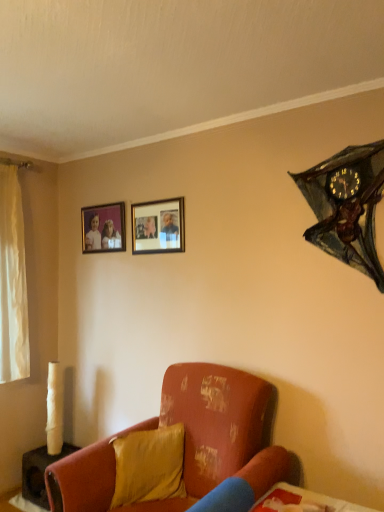
Describe the element at coordinates (103, 228) in the screenshot. This screenshot has width=384, height=512. I see `matte wooden picture frame at upper left, which is the second picture frame from right to left` at that location.

This screenshot has width=384, height=512. I want to click on matte black picture frame at upper center, which is the second picture frame in back-to-front order, so click(158, 226).

Identify the location of metallic bat-shaped clock at upper right. (347, 206).

Locate an element on the screen. This screenshot has width=384, height=512. distressed orange fabric couch at lower center is located at coordinates (180, 451).

Considering the relative sizes of distressed orange fabric couch at lower center and matte wooden picture frame at upper left, positioned as the 1th picture frame in left-to-right order, in the image provided, is distressed orange fabric couch at lower center thinner than matte wooden picture frame at upper left, positioned as the 1th picture frame in left-to-right order,?

No, distressed orange fabric couch at lower center is not thinner than matte wooden picture frame at upper left, positioned as the 1th picture frame in left-to-right order.

From the image's perspective, who appears lower, distressed orange fabric couch at lower center or matte wooden picture frame at upper left, which appears as the first picture frame when viewed from the back?

distressed orange fabric couch at lower center, from the image's perspective.

How different are the orientations of metallic bat-shaped clock at upper right and matte wooden picture frame at upper left, which appears as the first picture frame when viewed from the back, in degrees?

0.000541 degrees separate the facing orientations of metallic bat-shaped clock at upper right and matte wooden picture frame at upper left, which appears as the first picture frame when viewed from the back.

Looking at this image, is metallic bat-shaped clock at upper right wider or thinner than matte wooden picture frame at upper left, which is the second picture frame from right to left?

Considering their sizes, metallic bat-shaped clock at upper right looks broader than matte wooden picture frame at upper left, which is the second picture frame from right to left.

Is metallic bat-shaped clock at upper right oriented towards matte wooden picture frame at upper left, the second picture frame positioned from the front?

No, metallic bat-shaped clock at upper right does not turn towards matte wooden picture frame at upper left, the second picture frame positioned from the front.

Based on the photo, considering the positions of objects metallic bat-shaped clock at upper right and matte wooden picture frame at upper left, the second picture frame positioned from the front, in the image provided, who is behind, metallic bat-shaped clock at upper right or matte wooden picture frame at upper left, the second picture frame positioned from the front,?

matte wooden picture frame at upper left, the second picture frame positioned from the front, is behind.

Do you think matte wooden picture frame at upper left, the second picture frame positioned from the front, is within matte black picture frame at upper center, the first picture frame when ordered from right to left, or outside of it?

matte wooden picture frame at upper left, the second picture frame positioned from the front, is not enclosed by matte black picture frame at upper center, the first picture frame when ordered from right to left.

From a real-world perspective, is matte wooden picture frame at upper left, the second picture frame positioned from the front, physically below matte black picture frame at upper center, which is the second picture frame in back-to-front order?

No, from a real-world perspective, matte wooden picture frame at upper left, the second picture frame positioned from the front, is not beneath matte black picture frame at upper center, which is the second picture frame in back-to-front order.

Is matte wooden picture frame at upper left, which appears as the first picture frame when viewed from the back, positioned far away from matte black picture frame at upper center, which is the second picture frame in back-to-front order?

No, matte wooden picture frame at upper left, which appears as the first picture frame when viewed from the back, is not far from matte black picture frame at upper center, which is the second picture frame in back-to-front order.

How many degrees apart are the facing directions of metallic bat-shaped clock at upper right and satin yellow pillow at lower center?

The angle between the facing direction of metallic bat-shaped clock at upper right and the facing direction of satin yellow pillow at lower center is 49.3 degrees.

From a real-world perspective, does metallic bat-shaped clock at upper right sit lower than satin yellow pillow at lower center?

Actually, metallic bat-shaped clock at upper right is physically above satin yellow pillow at lower center in the real world.

Can you confirm if metallic bat-shaped clock at upper right is smaller than satin yellow pillow at lower center?

Correct, metallic bat-shaped clock at upper right occupies less space than satin yellow pillow at lower center.

Between metallic bat-shaped clock at upper right and satin yellow pillow at lower center, which one has smaller width?

Thinner between the two is metallic bat-shaped clock at upper right.

Is matte black picture frame at upper center, acting as the 1th picture frame starting from the front, smaller than satin yellow pillow at lower center?

Correct, matte black picture frame at upper center, acting as the 1th picture frame starting from the front, occupies less space than satin yellow pillow at lower center.

You are a GUI agent. You are given a task and a screenshot of the screen. Output one action in this format:
    pyautogui.click(x=<x>, y=<y>)
    Task: Click on the pillow in front of the matte black picture frame at upper center, acting as the 1th picture frame starting from the front
    The image size is (384, 512).
    Given the screenshot: What is the action you would take?
    pyautogui.click(x=149, y=465)

Is matte black picture frame at upper center, arranged as the 2th picture frame when viewed from the left, closer to the viewer compared to satin yellow pillow at lower center?

No, it is not.

From a real-world perspective, is matte black picture frame at upper center, acting as the 1th picture frame starting from the front, on satin yellow pillow at lower center?

Yes, from a real-world perspective, matte black picture frame at upper center, acting as the 1th picture frame starting from the front, is over satin yellow pillow at lower center

Can you confirm if matte black picture frame at upper center, which is the second picture frame in back-to-front order, is taller than matte wooden picture frame at upper left, positioned as the 1th picture frame in left-to-right order?

Correct, matte black picture frame at upper center, which is the second picture frame in back-to-front order, is much taller as matte wooden picture frame at upper left, positioned as the 1th picture frame in left-to-right order.

Is matte black picture frame at upper center, arranged as the 2th picture frame when viewed from the left, positioned beyond the bounds of matte wooden picture frame at upper left, the second picture frame positioned from the front?

Yes, matte black picture frame at upper center, arranged as the 2th picture frame when viewed from the left, is not within matte wooden picture frame at upper left, the second picture frame positioned from the front.

From the image's perspective, is matte black picture frame at upper center, the first picture frame when ordered from right to left, located above matte wooden picture frame at upper left, which is the second picture frame from right to left?

No, from the image's perspective, matte black picture frame at upper center, the first picture frame when ordered from right to left, is not on top of matte wooden picture frame at upper left, which is the second picture frame from right to left.

In the scene shown: Which is in front, matte black picture frame at upper center, arranged as the 2th picture frame when viewed from the left, or matte wooden picture frame at upper left, positioned as the 1th picture frame in left-to-right order?

matte black picture frame at upper center, arranged as the 2th picture frame when viewed from the left, is closer to the camera.

Is satin yellow pillow at lower center bigger or smaller than matte black picture frame at upper center, acting as the 1th picture frame starting from the front?

satin yellow pillow at lower center is bigger than matte black picture frame at upper center, acting as the 1th picture frame starting from the front.

Is satin yellow pillow at lower center in front of or behind matte black picture frame at upper center, which is the second picture frame in back-to-front order, in the image?

In the image, satin yellow pillow at lower center appears in front of matte black picture frame at upper center, which is the second picture frame in back-to-front order.

From the image's perspective, between satin yellow pillow at lower center and matte black picture frame at upper center, which is the second picture frame in back-to-front order, who is located below?

From the image's view, satin yellow pillow at lower center is below.

Who is shorter, satin yellow pillow at lower center or matte black picture frame at upper center, acting as the 1th picture frame starting from the front?

Standing shorter between the two is satin yellow pillow at lower center.

Find the location of a particular element. The image size is (384, 512). the 2nd picture frame located above the distressed orange fabric couch at lower center (from a real-world perspective) is located at coordinates pos(103,228).

Image resolution: width=384 pixels, height=512 pixels. There is a metallic bat-shaped clock at upper right. What are the coordinates of `the 2nd picture frame above it (from the image's perspective)` in the screenshot? It's located at tap(103, 228).

Based on their spatial positions, is matte wooden picture frame at upper left, which is the second picture frame from right to left, or distressed orange fabric couch at lower center closer to satin yellow pillow at lower center?

The object closer to satin yellow pillow at lower center is distressed orange fabric couch at lower center.

Estimate the real-world distances between objects in this image. Which object is further from distressed orange fabric couch at lower center, matte wooden picture frame at upper left, the second picture frame positioned from the front, or matte black picture frame at upper center, which is the second picture frame in back-to-front order?

matte wooden picture frame at upper left, the second picture frame positioned from the front.

From the image, which object appears to be nearer to satin yellow pillow at lower center, metallic bat-shaped clock at upper right or matte black picture frame at upper center, the first picture frame when ordered from right to left?

matte black picture frame at upper center, the first picture frame when ordered from right to left, lies closer to satin yellow pillow at lower center than the other object.

Estimate the real-world distances between objects in this image. Which object is further from matte wooden picture frame at upper left, the second picture frame positioned from the front, metallic bat-shaped clock at upper right or satin yellow pillow at lower center?

The object further to matte wooden picture frame at upper left, the second picture frame positioned from the front, is metallic bat-shaped clock at upper right.

Which object lies nearer to the anchor point metallic bat-shaped clock at upper right, satin yellow pillow at lower center or distressed orange fabric couch at lower center?

The object closer to metallic bat-shaped clock at upper right is distressed orange fabric couch at lower center.

Considering their positions, is distressed orange fabric couch at lower center positioned closer to matte black picture frame at upper center, which is the second picture frame in back-to-front order, than metallic bat-shaped clock at upper right?

metallic bat-shaped clock at upper right is closer to matte black picture frame at upper center, which is the second picture frame in back-to-front order.

When comparing their distances from matte wooden picture frame at upper left, positioned as the 1th picture frame in left-to-right order, does satin yellow pillow at lower center or matte black picture frame at upper center, acting as the 1th picture frame starting from the front, seem closer?

matte black picture frame at upper center, acting as the 1th picture frame starting from the front, is positioned closer to the anchor matte wooden picture frame at upper left, positioned as the 1th picture frame in left-to-right order.

When comparing their distances from satin yellow pillow at lower center, does matte black picture frame at upper center, arranged as the 2th picture frame when viewed from the left, or metallic bat-shaped clock at upper right seem closer?

matte black picture frame at upper center, arranged as the 2th picture frame when viewed from the left.

Locate an element on the screen. This screenshot has width=384, height=512. picture frame situated between matte wooden picture frame at upper left, the second picture frame positioned from the front, and metallic bat-shaped clock at upper right from left to right is located at coordinates (158, 226).

Where is `picture frame that lies between matte wooden picture frame at upper left, which appears as the first picture frame when viewed from the back, and satin yellow pillow at lower center from top to bottom`? picture frame that lies between matte wooden picture frame at upper left, which appears as the first picture frame when viewed from the back, and satin yellow pillow at lower center from top to bottom is located at coordinates (158, 226).

Where is `clock between matte wooden picture frame at upper left, the second picture frame positioned from the front, and satin yellow pillow at lower center in the up-down direction`? This screenshot has height=512, width=384. clock between matte wooden picture frame at upper left, the second picture frame positioned from the front, and satin yellow pillow at lower center in the up-down direction is located at coordinates (347, 206).

Identify the location of clock between matte black picture frame at upper center, the first picture frame when ordered from right to left, and distressed orange fabric couch at lower center from top to bottom. (347, 206).